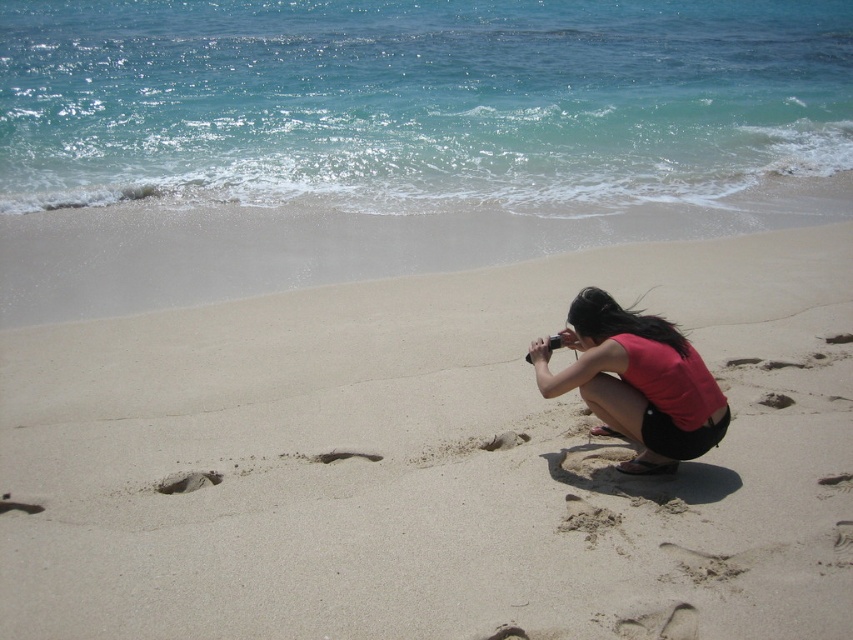
You are a photographer trying to capture the scene with your camera. You notice the matte red shirt at lower right and the brown sandy footprint at lower left. Which object should you focus on if you want to capture the larger one in your shot?

The matte red shirt at lower right is larger in size than the brown sandy footprint at lower left, so you should focus on the matte red shirt at lower right to capture the larger one in your shot.

You are a photographer standing on the beach. You notice the beige sand at center and the matte red shirt at lower right. Which object is taller when viewed from your position?

The matte red shirt at lower right is taller than the beige sand at center.

You are a photographer trying to capture the brown sandy footprint at center in your shot. However, the matte red shirt at lower right is blocking your view. Can you adjust your position to ensure the footprint is visible without the shirt obstructing it?

The matte red shirt at lower right is in front of the brown sandy footprint at center, so moving your position to the side or behind the shirt would allow the footprint to be visible without obstruction.